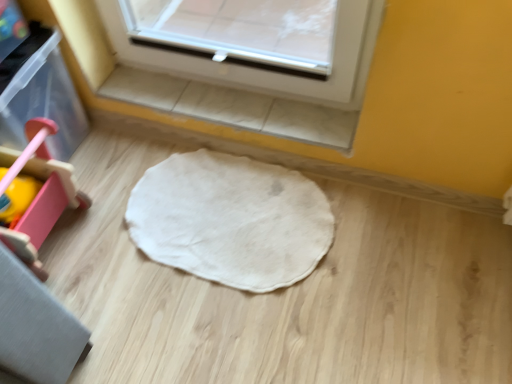
What do you see at coordinates (230, 220) in the screenshot?
I see `white soft mat at center` at bounding box center [230, 220].

This screenshot has height=384, width=512. What are the coordinates of `white soft mat at center` in the screenshot? It's located at (230, 220).

I want to click on pink plastic walker at left, so click(38, 276).

What do you see at coordinates (38, 276) in the screenshot? I see `pink plastic walker at left` at bounding box center [38, 276].

Consider the image. Measure the distance between point (5, 273) and camera.

Point (5, 273) and camera are 27.87 inches apart.

Locate an element on the screen. This screenshot has height=384, width=512. white soft mat at center is located at coordinates (230, 220).

Can you confirm if white soft mat at center is positioned to the right of pink plastic walker at left?

Yes.

Is white soft mat at center in front of pink plastic walker at left?

No, white soft mat at center is further to the viewer.

Is point (161, 236) positioned after point (15, 362)?

Yes, it is.

From the image's perspective, which is below, white soft mat at center or pink plastic walker at left?

white soft mat at center appears lower in the image.

From a real-world perspective, is white soft mat at center over pink plastic walker at left?

No, from a real-world perspective, white soft mat at center is not above pink plastic walker at left.

Is white soft mat at center wider or thinner than pink plastic walker at left?

In the image, white soft mat at center appears to be wider than pink plastic walker at left.

Considering the sizes of white soft mat at center and pink plastic walker at left in the image, is white soft mat at center taller or shorter than pink plastic walker at left?

Clearly, white soft mat at center is shorter compared to pink plastic walker at left.

Does white soft mat at center have a larger size compared to pink plastic walker at left?

No.

Is white soft mat at center not inside pink plastic walker at left?

white soft mat at center is positioned outside pink plastic walker at left.

In the scene shown: Are white soft mat at center and pink plastic walker at left far apart?

No, there isn't a large distance between white soft mat at center and pink plastic walker at left.

Is white soft mat at center turned away from pink plastic walker at left?

No, white soft mat at center is not facing away from pink plastic walker at left.

Can you tell me how much white soft mat at center and pink plastic walker at left differ in facing direction?

The angular difference between white soft mat at center and pink plastic walker at left is 90 degrees.

This screenshot has width=512, height=384. In order to click on mat on the right of pink plastic walker at left in this screenshot , I will do `click(230, 220)`.

Between pink plastic walker at left and white soft mat at center, which one appears on the left side from the viewer's perspective?

pink plastic walker at left.

In the scene shown: Which is behind, pink plastic walker at left or white soft mat at center?

Positioned behind is white soft mat at center.

Considering the positions of point (28, 270) and point (153, 174), is point (28, 270) closer or farther from the camera than point (153, 174)?

Clearly, point (28, 270) is closer to the camera than point (153, 174).

From the image's perspective, does pink plastic walker at left appear lower than white soft mat at center?

No, from the image's perspective, pink plastic walker at left is not beneath white soft mat at center.

From a real-world perspective, is pink plastic walker at left on top of white soft mat at center?

Correct, in the physical world, pink plastic walker at left is higher than white soft mat at center.

Is pink plastic walker at left wider or thinner than white soft mat at center?

Clearly, pink plastic walker at left has less width compared to white soft mat at center.

Can you confirm if pink plastic walker at left is taller than white soft mat at center?

Correct, pink plastic walker at left is much taller as white soft mat at center.

Does pink plastic walker at left have a larger size compared to white soft mat at center?

Yes, pink plastic walker at left is bigger than white soft mat at center.

Would you say pink plastic walker at left contains white soft mat at center?

No, white soft mat at center is located outside of pink plastic walker at left.

Is pink plastic walker at left positioned far away from white soft mat at center?

No, there isn't a large distance between pink plastic walker at left and white soft mat at center.

Based on the photo, is pink plastic walker at left oriented away from white soft mat at center?

No, pink plastic walker at left is not facing away from white soft mat at center.

Measure the distance between pink plastic walker at left and white soft mat at center.

pink plastic walker at left and white soft mat at center are 40.17 centimeters apart from each other.

Locate an element on the screen. furniture in front of the white soft mat at center is located at coordinates (38, 276).

At what (x,y) coordinates should I click in order to perform the action: click on furniture on the left of white soft mat at center. Please return your answer as a coordinate pair (x, y). The width and height of the screenshot is (512, 384). Looking at the image, I should click on (38, 276).

The height and width of the screenshot is (384, 512). What are the coordinates of `mat behind the pink plastic walker at left` in the screenshot? It's located at (230, 220).